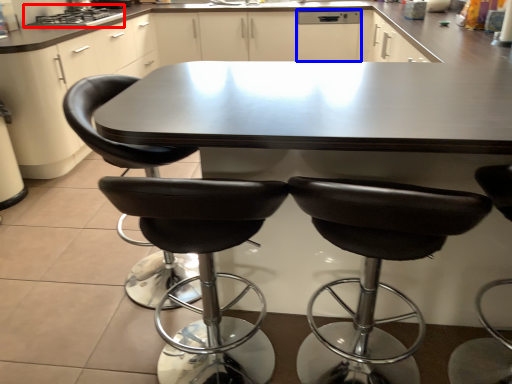
Question: Which object appears farthest to the camera in this image, stove (highlighted by a red box) or dish washer (highlighted by a blue box)?

Choices:
 (A) stove
 (B) dish washer

Answer: (B)